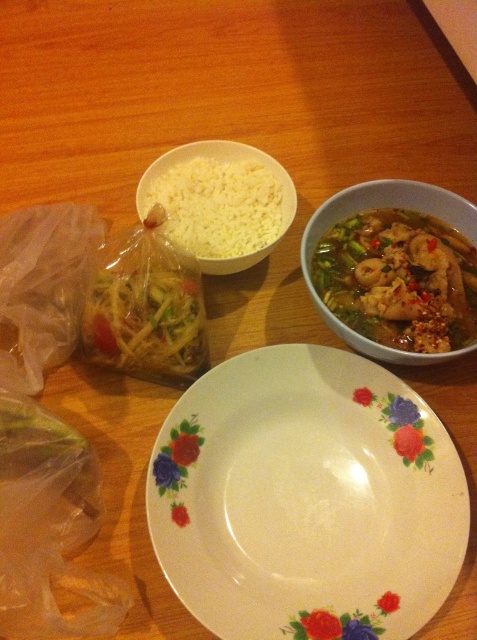
You are a drone trying to deliver a small package to the table. You need to land at one of the two points marked as point (401, 556) or point (183, 284). Which point is closer to you when you approach the table from above?

Point (401, 556) is closer to the viewer than point (183, 284), so the drone should land at point (401, 556) as it is nearer when approaching from above.